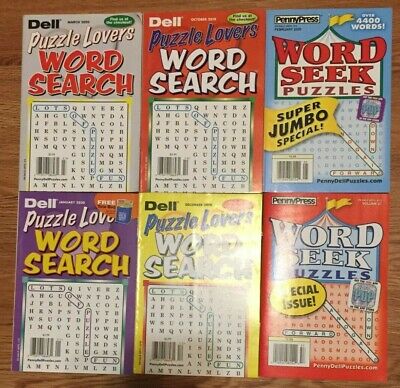
Locate an element on the screen. wooden table top is located at coordinates (9, 87).